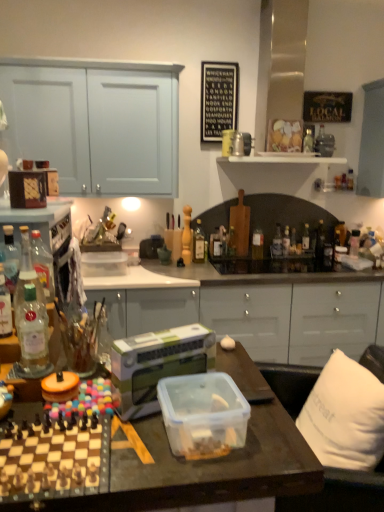
Describe the element at coordinates (286, 242) in the screenshot. I see `clear glass bottle at center, which ranks as the ninth bottle in left-to-right order` at that location.

Image resolution: width=384 pixels, height=512 pixels. What do you see at coordinates (250, 308) in the screenshot? I see `white glossy cabinets at center` at bounding box center [250, 308].

The width and height of the screenshot is (384, 512). What do you see at coordinates (277, 243) in the screenshot?
I see `translucent glass bottle at center, positioned as the 8th bottle in left-to-right order` at bounding box center [277, 243].

The height and width of the screenshot is (512, 384). Find the location of `clear glass bottle at left, the first bottle viewed from the left`. clear glass bottle at left, the first bottle viewed from the left is located at coordinates (10, 258).

The width and height of the screenshot is (384, 512). Describe the element at coordinates (320, 240) in the screenshot. I see `translucent glass bottle at center, marked as the fourth bottle in a back-to-front arrangement` at that location.

This screenshot has width=384, height=512. I want to click on clear glass bottle at center, which ranks as the ninth bottle in left-to-right order, so click(286, 242).

Considering their positions, is white fabric pillow at right located in front of or behind translucent glass bottle at center, marked as the 6th bottle in a left-to-right arrangement?

white fabric pillow at right is positioned closer to the viewer than translucent glass bottle at center, marked as the 6th bottle in a left-to-right arrangement.

Is point (316, 382) farther from camera compared to point (234, 250)?

No, (316, 382) is closer to viewer.

Based on the photo, is white fabric pillow at right bigger or smaller than translucent glass bottle at center, the seventh bottle when ordered from front to back?

white fabric pillow at right is bigger than translucent glass bottle at center, the seventh bottle when ordered from front to back.

From the picture: Is translucent glass bottle at center, the 5th bottle in the front-to-back sequence, positioned far away from white fabric pillow at right?

Yes.

Image resolution: width=384 pixels, height=512 pixels. There is a white fabric pillow at right. In order to click on the 12th bottle above it (from the image's perspective) in this screenshot , I will do `click(187, 236)`.

Does translucent glass bottle at center, the 5th bottle in the front-to-back sequence, come in front of white fabric pillow at right?

No, it is behind white fabric pillow at right.

Considering the relative positions of translucent glass bottle at center, which is the tenth bottle in right-to-left order, and white fabric pillow at right in the image provided, is translucent glass bottle at center, which is the tenth bottle in right-to-left order, to the right of white fabric pillow at right from the viewer's perspective?

No.

From the image's perspective, which is above, white glossy cabinets at center or orange plastic lid at center, marked as the 2th appliance in a right-to-left arrangement?

orange plastic lid at center, marked as the 2th appliance in a right-to-left arrangement, from the image's perspective.

From a real-world perspective, which is physically below, white glossy cabinets at center or orange plastic lid at center, the first appliance in the left-to-right sequence?

white glossy cabinets at center, from a real-world perspective.

Can you confirm if white glossy cabinets at center is thinner than orange plastic lid at center, the first appliance in the left-to-right sequence?

Incorrect, the width of white glossy cabinets at center is not less than that of orange plastic lid at center, the first appliance in the left-to-right sequence.

Is white glossy cabinets at center next to orange plastic lid at center, the first appliance in the left-to-right sequence?

No, white glossy cabinets at center is not beside orange plastic lid at center, the first appliance in the left-to-right sequence.

How distant is clear glass bottle at left, the second bottle from the left, from translucent glass bottle at center, marked as the fourth bottle in a back-to-front arrangement?

clear glass bottle at left, the second bottle from the left, and translucent glass bottle at center, marked as the fourth bottle in a back-to-front arrangement, are 2.25 meters apart.

Who is bigger, clear glass bottle at left, which is the 12th bottle in right-to-left order, or translucent glass bottle at center, the tenth bottle from the front?

translucent glass bottle at center, the tenth bottle from the front, is bigger.

From the clear glass bottle at left, the third bottle positioned from the front, count 7th bottles backward and point to it. Please provide its 2D coordinates.

[(320, 240)]

Is clear glass bottle at left, the third bottle positioned from the front, wider or thinner than translucent glass bottle at center, the tenth bottle from the front?

In the image, clear glass bottle at left, the third bottle positioned from the front, appears to be more narrow than translucent glass bottle at center, the tenth bottle from the front.

Considering the sizes of objects white plastic toaster at center, the first appliance viewed from the right, and white glossy cabinets at center in the image provided, who is smaller, white plastic toaster at center, the first appliance viewed from the right, or white glossy cabinets at center?

Smaller between the two is white plastic toaster at center, the first appliance viewed from the right.

Which object is thinner, white plastic toaster at center, the first appliance viewed from the right, or white glossy cabinets at center?

With smaller width is white plastic toaster at center, the first appliance viewed from the right.

Could you measure the distance between white plastic toaster at center, the first appliance viewed from the right, and white glossy cabinets at center?

A distance of 1.46 meters exists between white plastic toaster at center, the first appliance viewed from the right, and white glossy cabinets at center.

From their relative heights in the image, would you say white plastic toaster at center, the 2th appliance in the left-to-right sequence, is taller or shorter than white glossy cabinets at center?

Considering their sizes, white plastic toaster at center, the 2th appliance in the left-to-right sequence, has less height than white glossy cabinets at center.

Is clear glass bottle at left, positioned as the thirteenth bottle in right-to-left order, oriented towards black paperboard at upper center?

No, clear glass bottle at left, positioned as the thirteenth bottle in right-to-left order, is not oriented towards black paperboard at upper center.

Which is more to the right, clear glass bottle at left, the first bottle viewed from the left, or black paperboard at upper center?

black paperboard at upper center is more to the right.

Is clear glass bottle at left, the first bottle viewed from the left, further to the viewer compared to black paperboard at upper center?

No, clear glass bottle at left, the first bottle viewed from the left, is in front of black paperboard at upper center.

Does clear glass bottle at left, positioned as the thirteenth bottle in right-to-left order, have a larger size compared to black paperboard at upper center?

No.

Are black paperboard at upper center and white glossy cabinets at center located far from each other?

black paperboard at upper center is positioned a significant distance from white glossy cabinets at center.

Is black paperboard at upper center inside the boundaries of white glossy cabinets at center, or outside?

black paperboard at upper center is not inside white glossy cabinets at center, it's outside.

Considering the sizes of objects black paperboard at upper center and white glossy cabinets at center in the image provided, who is taller, black paperboard at upper center or white glossy cabinets at center?

white glossy cabinets at center is taller.

From a real-world perspective, relative to white glossy cabinets at center, is black paperboard at upper center vertically above or below?

From a real-world perspective, black paperboard at upper center is physically above white glossy cabinets at center.

Image resolution: width=384 pixels, height=512 pixels. Identify the location of pillow in front of the translucent glass bottle at center, the seventh bottle when ordered from front to back. (x=345, y=415).

Find the location of `bottle that is the 4th object to the left of the white fabric pillow at right, starting at the anchor`. bottle that is the 4th object to the left of the white fabric pillow at right, starting at the anchor is located at coordinates (187, 236).

In the scene shown: When comparing their distances from white glossy cabinets at center, does black paperboard at upper center or clear glass bottle at left, which is the 11th bottle from back to front, seem further?

clear glass bottle at left, which is the 11th bottle from back to front, is positioned further to the anchor white glossy cabinets at center.

Based on their spatial positions, is clear glass bottle at left, which is the 12th bottle in right-to-left order, or white fabric pillow at right closer to clear glass bottle at upper center, marked as the tenth bottle in a left-to-right arrangement?

Based on the image, white fabric pillow at right appears to be nearer to clear glass bottle at upper center, marked as the tenth bottle in a left-to-right arrangement.

When comparing their distances from clear glass bottle at left, marked as the 1th bottle in a front-to-back arrangement, does translucent glass bottle at center, placed as the seventh bottle when sorted from left to right, or clear glass bottle at left, the first bottle viewed from the left, seem further?

translucent glass bottle at center, placed as the seventh bottle when sorted from left to right, is positioned further to the anchor clear glass bottle at left, marked as the 1th bottle in a front-to-back arrangement.

Looking at the image, which one is located closer to translucent glass bottle at center, placed as the seventh bottle when sorted from left to right, translucent glass bottle at center, acting as the eighth bottle starting from the right, or clear glass bottle at left, the third bottle positioned from the front?

translucent glass bottle at center, acting as the eighth bottle starting from the right, is positioned closer to the anchor translucent glass bottle at center, placed as the seventh bottle when sorted from left to right.

Looking at the image, which one is located closer to clear glass bottle at left, which is the 12th bottle in right-to-left order, clear glass bottle at left, which is counted as the 3th bottle, starting from the left, or translucent glass bottle at center, the sixth bottle from the back?

clear glass bottle at left, which is counted as the 3th bottle, starting from the left.

When comparing their distances from white plastic toaster at center, the 2th appliance in the left-to-right sequence, does translucent glass bottle at center, which is counted as the ninth bottle, starting from the right, or white fabric pillow at right seem further?

Among the two, translucent glass bottle at center, which is counted as the ninth bottle, starting from the right, is located further to white plastic toaster at center, the 2th appliance in the left-to-right sequence.

Which object lies nearer to the anchor point white glossy cabinets at center, translucent glass bottle at center, placed as the eighth bottle when sorted from back to front, or translucent glass bottle at center, marked as the 7th bottle in a right-to-left arrangement?

translucent glass bottle at center, placed as the eighth bottle when sorted from back to front.

From the picture: Considering their positions, is clear glass bottle at left, which appears as the eleventh bottle when viewed from the right, positioned further to translucent glass bottle at center, marked as the 7th bottle in a right-to-left arrangement, than clear glass bottle at right, placed as the 12th bottle when sorted from left to right?

Based on the image, clear glass bottle at left, which appears as the eleventh bottle when viewed from the right, appears to be further to translucent glass bottle at center, marked as the 7th bottle in a right-to-left arrangement.

Locate an element on the screen. This screenshot has height=512, width=384. bulletin board located between white fabric pillow at right and translucent glass bottle at center, acting as the eighth bottle starting from the right, in the depth direction is located at coordinates (218, 99).

Image resolution: width=384 pixels, height=512 pixels. I want to click on cabinetry between white plastic toaster at center, the 2th appliance in the left-to-right sequence, and clear glass bottle at right, which ranks as the second bottle in right-to-left order, along the z-axis, so click(250, 308).

I want to click on shelf between translucent glass bottle at center, which appears as the fourth bottle when viewed from the left, and clear glass bottle at upper center, which ranks as the 10th bottle in back-to-front order, so click(283, 159).

At what (x,y) coordinates should I click in order to perform the action: click on cabinetry located between white plastic toaster at center, the first appliance viewed from the right, and teal glass jar at center in the depth direction. Please return your answer as a coordinate pair (x, y). The width and height of the screenshot is (384, 512). Looking at the image, I should click on (250, 308).